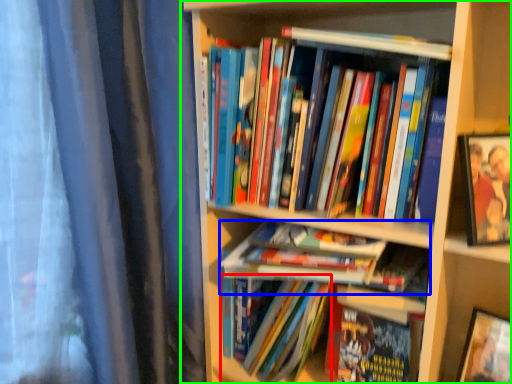
Question: Based on their relative distances, which object is farther from book (highlighted by a red box)? Choose from book (highlighted by a blue box) and bookcase (highlighted by a green box).

Choices:
 (A) book
 (B) bookcase

Answer: (B)